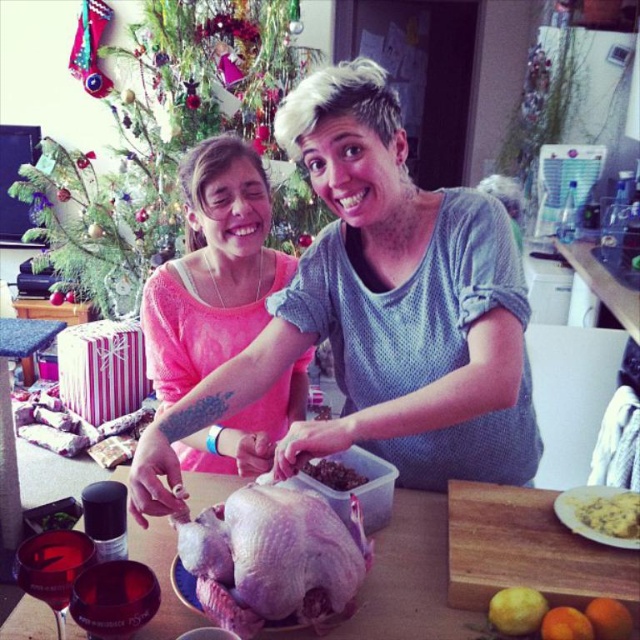
Question: Observing the image, what is the correct spatial positioning of matte pink sweater at upper left in reference to wooden cutting board at center?

Choices:
 (A) right
 (B) left

Answer: (B)

Question: Which object is closer to the camera taking this photo?

Choices:
 (A) pink matte shirt at upper left
 (B) yellow cheesy omelette at center right

Answer: (A)

Question: Which object appears closest to the camera in this image?

Choices:
 (A) yellow cheesy omelette at center right
 (B) brown crumbly mixture at center

Answer: (A)

Question: Which point is farther to the camera?

Choices:
 (A) 200,340
 (B) 360,186
 (C) 588,500
 (D) 288,16

Answer: (D)

Question: Where is pink matte shirt at upper left located in relation to pale pink raw turkey at center in the image?

Choices:
 (A) above
 (B) below

Answer: (A)

Question: Does pink matte shirt at upper left come in front of brown crumbly mixture at center?

Choices:
 (A) no
 (B) yes

Answer: (B)